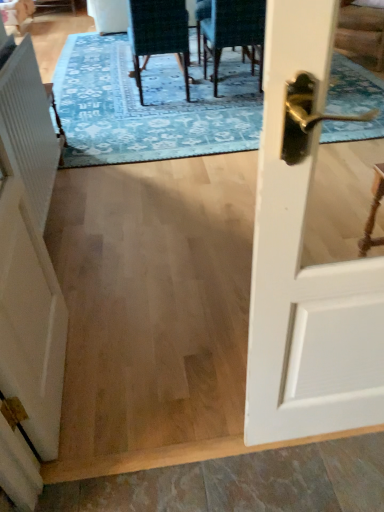
Question: From the image's perspective, is blue textured rug at center above or below velvet dark green chair at center, marked as the first chair in a left-to-right arrangement?

Choices:
 (A) above
 (B) below

Answer: (A)

Question: Would you say blue textured rug at center is to the left or to the right of velvet dark green chair at center, the 2th chair viewed from the right, in the picture?

Choices:
 (A) left
 (B) right

Answer: (A)

Question: Estimate the real-world distances between objects in this image. Which object is farther from the white glossy door handle at right?

Choices:
 (A) blue textured rug at center
 (B) velvet dark green chair at upper center, the 1th chair from the right
 (C) white ribbed radiator at left
 (D) velvet dark green chair at center, the 2th chair viewed from the right
 (E) white matte barn door at left

Answer: (B)

Question: Which of these objects is positioned closest to the white glossy door handle at right?

Choices:
 (A) white ribbed radiator at left
 (B) blue textured rug at center
 (C) velvet dark green chair at upper center, the 1th chair from the right
 (D) white matte barn door at left
 (E) velvet dark green chair at center, marked as the first chair in a left-to-right arrangement

Answer: (D)